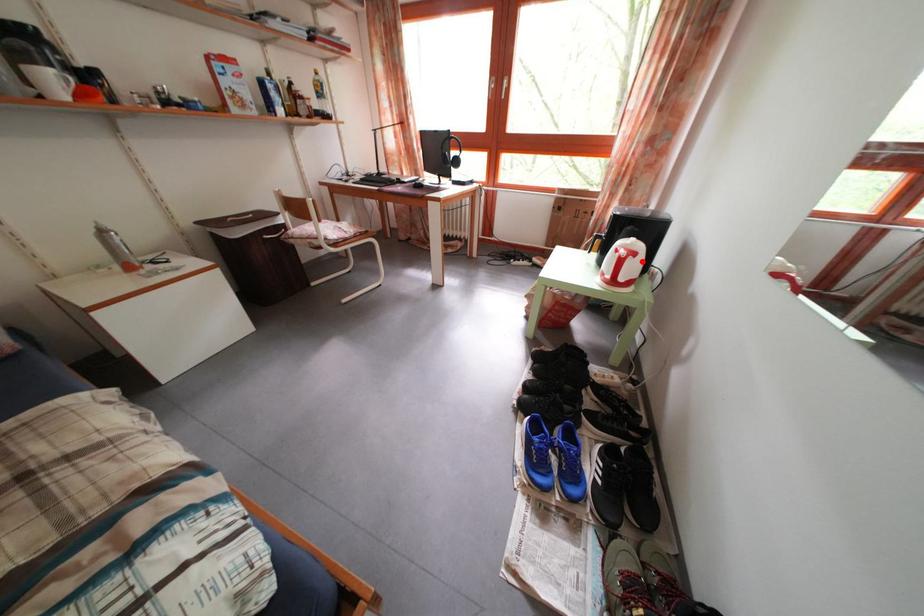
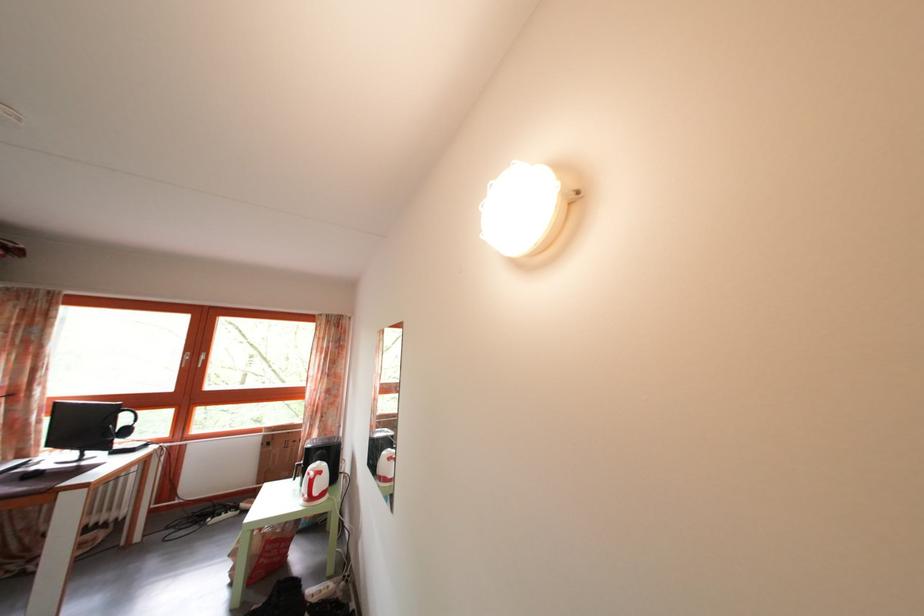
Question: I am providing you with two images of the same scene from different viewpoints. A red point is shown in image1. For the corresponding object point in image2, is it positioned nearer or farther from the camera?

Choices:
 (A) Nearer
 (B) Farther

Answer: (A)